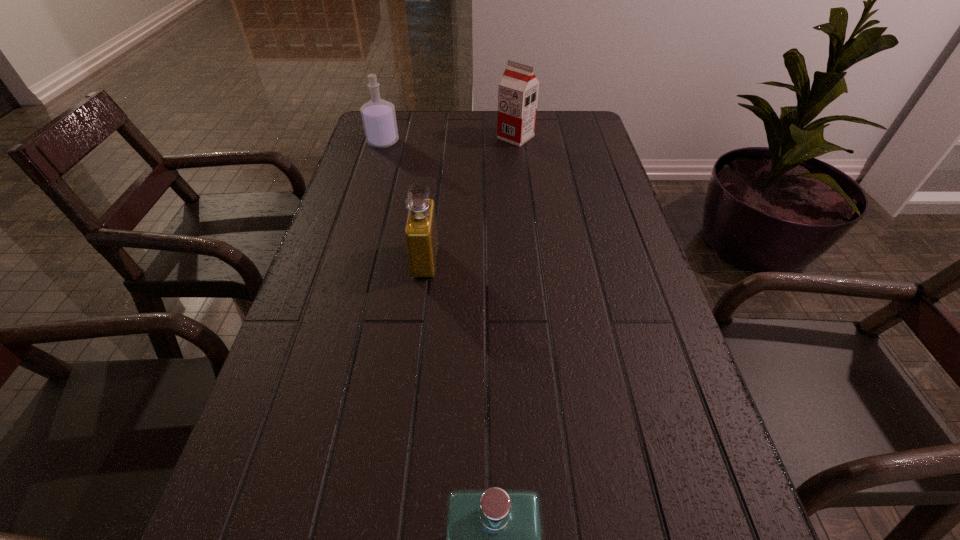
The image size is (960, 540). In order to click on object that stands as the second closest to the second object from left to right in this screenshot , I will do `click(518, 89)`.

Identify which object is the second nearest to the nearest object. Please provide its 2D coordinates. Your answer should be formatted as a tuple, i.e. [(x, y)], where the tuple contains the x and y coordinates of a point satisfying the conditions above.

[(518, 89)]

Identify the location of perfume that is the second nearest to the third object from right to left. This screenshot has height=540, width=960. (494, 539).

The width and height of the screenshot is (960, 540). Find the location of `perfume that can be found as the second closest to the second nearest object`. perfume that can be found as the second closest to the second nearest object is located at coordinates (494, 539).